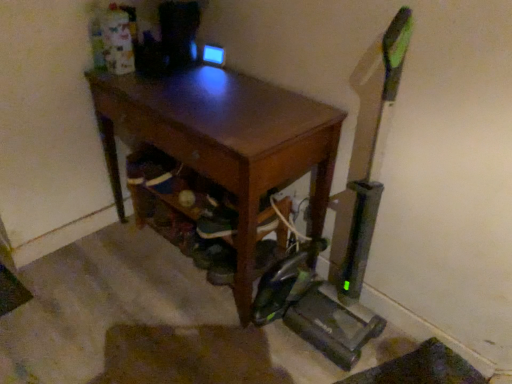
Locate an element on the screen. vacant region above brown wooden desk at center (from a real-world perspective) is located at coordinates (203, 94).